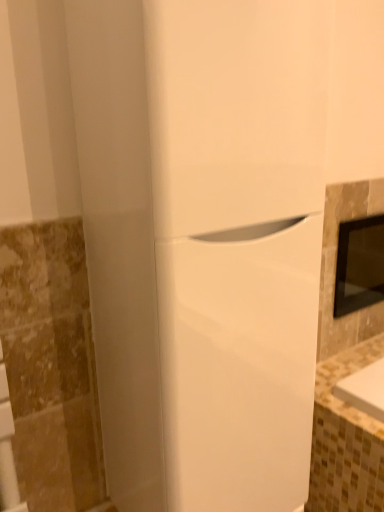
The image size is (384, 512). What do you see at coordinates (202, 242) in the screenshot?
I see `white glossy refrigerator at center` at bounding box center [202, 242].

Identify the location of white glossy refrigerator at center. (202, 242).

Measure the distance between black glass medicine cabinet at right and camera.

black glass medicine cabinet at right is 4.49 feet away from camera.

The height and width of the screenshot is (512, 384). What do you see at coordinates (359, 265) in the screenshot?
I see `black glass medicine cabinet at right` at bounding box center [359, 265].

The image size is (384, 512). I want to click on black glass medicine cabinet at right, so click(359, 265).

Where is `white glossy refrigerator at center`? white glossy refrigerator at center is located at coordinates (202, 242).

Is white glossy refrigerator at center to the right of black glass medicine cabinet at right from the viewer's perspective?

No, white glossy refrigerator at center is not to the right of black glass medicine cabinet at right.

Considering their positions, is white glossy refrigerator at center located in front of or behind black glass medicine cabinet at right?

white glossy refrigerator at center is positioned closer to the viewer than black glass medicine cabinet at right.

Is point (154, 214) closer or farther from the camera than point (353, 234)?

Clearly, point (154, 214) is closer to the camera than point (353, 234).

From the image's perspective, which object appears higher, white glossy refrigerator at center or black glass medicine cabinet at right?

black glass medicine cabinet at right, from the image's perspective.

From a real-world perspective, is white glossy refrigerator at center located higher than black glass medicine cabinet at right?

Yes, from a real-world perspective, white glossy refrigerator at center is above black glass medicine cabinet at right.

Considering the relative sizes of white glossy refrigerator at center and black glass medicine cabinet at right in the image provided, is white glossy refrigerator at center thinner than black glass medicine cabinet at right?

In fact, white glossy refrigerator at center might be wider than black glass medicine cabinet at right.

Does white glossy refrigerator at center have a greater height compared to black glass medicine cabinet at right?

Yes.

From the picture: Can you confirm if white glossy refrigerator at center is smaller than black glass medicine cabinet at right?

No, white glossy refrigerator at center is not smaller than black glass medicine cabinet at right.

Is white glossy refrigerator at center situated inside black glass medicine cabinet at right or outside?

white glossy refrigerator at center cannot be found inside black glass medicine cabinet at right.

Is white glossy refrigerator at center touching black glass medicine cabinet at right?

No, white glossy refrigerator at center is not next to black glass medicine cabinet at right.

Looking at this image, is white glossy refrigerator at center oriented towards black glass medicine cabinet at right?

No, white glossy refrigerator at center does not turn towards black glass medicine cabinet at right.

From the picture: How many degrees apart are the facing directions of white glossy refrigerator at center and black glass medicine cabinet at right?

0.00665 degrees.

Where is `home appliance located below the black glass medicine cabinet at right (from the image's perspective)`? The image size is (384, 512). home appliance located below the black glass medicine cabinet at right (from the image's perspective) is located at coordinates (202, 242).

Is black glass medicine cabinet at right at the left side of white glossy refrigerator at center?

In fact, black glass medicine cabinet at right is to the right of white glossy refrigerator at center.

Between black glass medicine cabinet at right and white glossy refrigerator at center, which one is positioned behind?

black glass medicine cabinet at right.

Considering the positions of point (366, 250) and point (140, 253), is point (366, 250) closer or farther from the camera than point (140, 253)?

Point (366, 250) appears to be farther away from the viewer than point (140, 253).

From the image's perspective, is black glass medicine cabinet at right below white glossy refrigerator at center?

No, from the image's perspective, black glass medicine cabinet at right is not below white glossy refrigerator at center.

From a real-world perspective, is black glass medicine cabinet at right on top of white glossy refrigerator at center?

No, from a real-world perspective, black glass medicine cabinet at right is not over white glossy refrigerator at center

Which of these two, black glass medicine cabinet at right or white glossy refrigerator at center, is wider?

white glossy refrigerator at center is wider.

From the picture: Considering the sizes of objects black glass medicine cabinet at right and white glossy refrigerator at center in the image provided, who is shorter, black glass medicine cabinet at right or white glossy refrigerator at center?

black glass medicine cabinet at right.

Can you confirm if black glass medicine cabinet at right is bigger than white glossy refrigerator at center?

No, black glass medicine cabinet at right is not bigger than white glossy refrigerator at center.

Is black glass medicine cabinet at right located outside white glossy refrigerator at center?

black glass medicine cabinet at right lies outside white glossy refrigerator at center's area.

Looking at this image, is black glass medicine cabinet at right with white glossy refrigerator at center?

They are not placed beside each other.

Is black glass medicine cabinet at right facing away from white glossy refrigerator at center?

No, black glass medicine cabinet at right's orientation is not away from white glossy refrigerator at center.

How different are the orientations of black glass medicine cabinet at right and white glossy refrigerator at center in degrees?

The angle between the facing direction of black glass medicine cabinet at right and the facing direction of white glossy refrigerator at center is 0.00665 degrees.

How distant is black glass medicine cabinet at right from white glossy refrigerator at center?

They are 30.09 inches apart.

In order to click on home appliance below the black glass medicine cabinet at right (from the image's perspective) in this screenshot , I will do `click(202, 242)`.

The height and width of the screenshot is (512, 384). In order to click on medicine cabinet behind the white glossy refrigerator at center in this screenshot , I will do `click(359, 265)`.

This screenshot has height=512, width=384. I want to click on medicine cabinet that appears above the white glossy refrigerator at center (from the image's perspective), so click(359, 265).